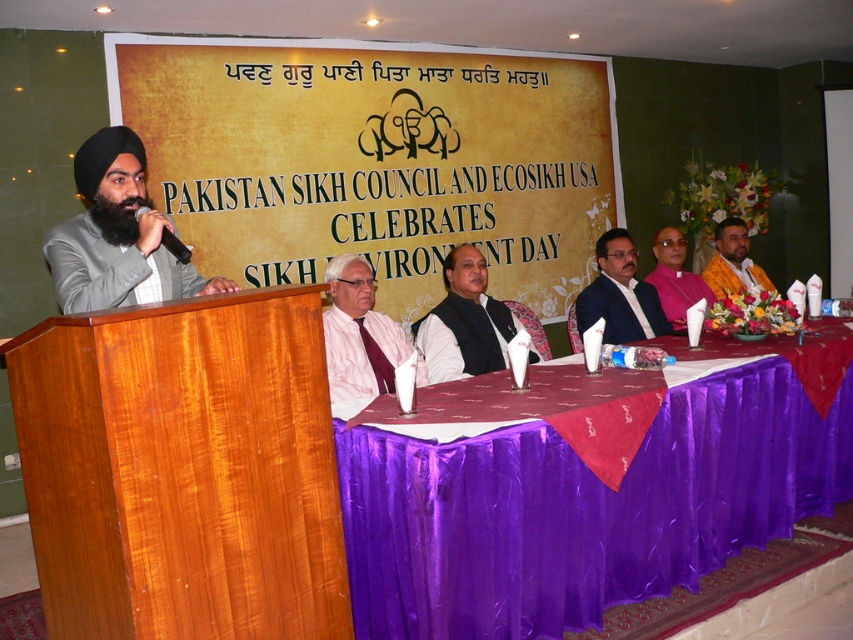
Question: Which object appears farthest from the camera in this image?

Choices:
 (A) dark blue fabric at center
 (B) matte gray suit at left
 (C) pink fabric at center

Answer: (C)

Question: Observing the image, what is the correct spatial positioning of matte gray suit at left in reference to white textured shirt at center?

Choices:
 (A) below
 (B) above

Answer: (B)

Question: Which object is positioned farthest from the matte gray suit at left?

Choices:
 (A) gold matte signboard at upper center
 (B) purple satin tablecloth at lower center

Answer: (A)

Question: Is purple satin tablecloth at lower center smaller than dark blue suit at center?

Choices:
 (A) yes
 (B) no

Answer: (B)

Question: Is gold matte signboard at upper center above white textured shirt at center?

Choices:
 (A) yes
 (B) no

Answer: (A)

Question: Which point is farther from the camera taking this photo?

Choices:
 (A) (265, 272)
 (B) (698, 285)

Answer: (B)